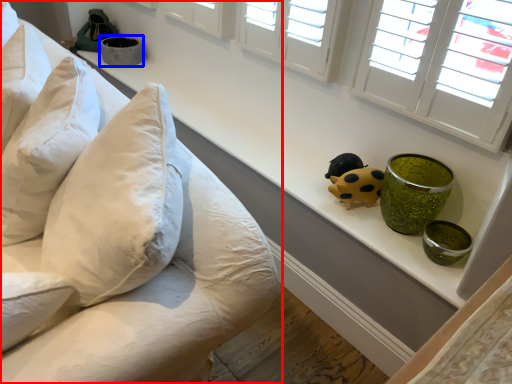
Question: Among these objects, which one is nearest to the camera, furniture (highlighted by a red box) or glass bowl (highlighted by a blue box)?

Choices:
 (A) furniture
 (B) glass bowl

Answer: (A)